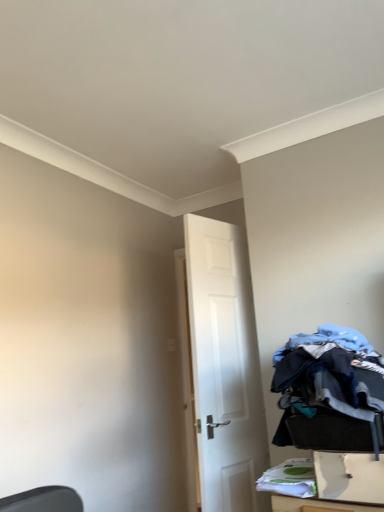
Question: Is white matte door at center aimed at white plastic drawer at lower right?

Choices:
 (A) yes
 (B) no

Answer: (B)

Question: Considering the relative positions of white matte door at center and white plastic drawer at lower right in the image provided, is white matte door at center to the right of white plastic drawer at lower right from the viewer's perspective?

Choices:
 (A) no
 (B) yes

Answer: (A)

Question: Is white matte door at center smaller than white plastic drawer at lower right?

Choices:
 (A) no
 (B) yes

Answer: (A)

Question: Would you say white matte door at center is a long distance from white plastic drawer at lower right?

Choices:
 (A) yes
 (B) no

Answer: (B)

Question: Does white matte door at center appear on the left side of white plastic drawer at lower right?

Choices:
 (A) yes
 (B) no

Answer: (A)

Question: Is white matte door at center surrounding white plastic drawer at lower right?

Choices:
 (A) no
 (B) yes

Answer: (A)

Question: Is white plastic drawer at lower right inside denim fabric laundry at lower right?

Choices:
 (A) no
 (B) yes

Answer: (A)

Question: Is denim fabric laundry at lower right looking in the opposite direction of white plastic drawer at lower right?

Choices:
 (A) yes
 (B) no

Answer: (B)

Question: From a real-world perspective, does denim fabric laundry at lower right sit lower than white plastic drawer at lower right?

Choices:
 (A) yes
 (B) no

Answer: (B)

Question: Is the depth of denim fabric laundry at lower right less than that of white plastic drawer at lower right?

Choices:
 (A) no
 (B) yes

Answer: (B)

Question: Is the surface of denim fabric laundry at lower right in direct contact with white plastic drawer at lower right?

Choices:
 (A) no
 (B) yes

Answer: (A)

Question: From the image's perspective, is denim fabric laundry at lower right under white plastic drawer at lower right?

Choices:
 (A) no
 (B) yes

Answer: (A)

Question: Is white matte door at center outside of denim fabric laundry at lower right?

Choices:
 (A) yes
 (B) no

Answer: (A)